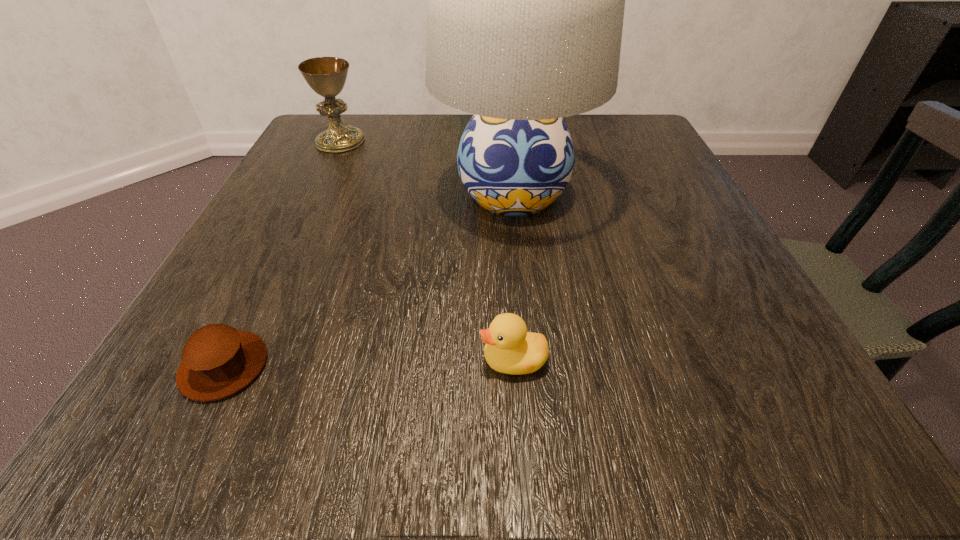
Where is `the third nearest object`? This screenshot has height=540, width=960. the third nearest object is located at coordinates (525, 0).

Where is `lampshade`? lampshade is located at coordinates click(x=525, y=0).

Identify the location of the farthest object. The width and height of the screenshot is (960, 540). (327, 76).

At what (x,y) coordinates should I click in order to perform the action: click on the third shortest object. Please return your answer as a coordinate pair (x, y). This screenshot has height=540, width=960. Looking at the image, I should click on (327, 76).

Locate an element on the screen. duckling is located at coordinates (509, 348).

This screenshot has width=960, height=540. I want to click on muffin, so click(x=218, y=360).

Where is `free location located on the front-facing side of the lampshade`? The height and width of the screenshot is (540, 960). free location located on the front-facing side of the lampshade is located at coordinates (536, 427).

Identify the location of vacant space located on the right of the farthest object. (425, 142).

Identify the location of vacant space positioned on the face of the duckling. This screenshot has width=960, height=540. (201, 360).

Locate an element on the screen. blank area located 0.050m on the face of the duckling is located at coordinates (439, 360).